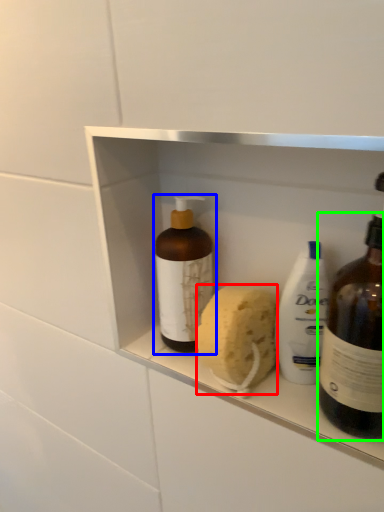
Question: Based on their relative distances, which object is farther from soap (highlighted by a red box)? Choose from bottle (highlighted by a blue box) and bottle (highlighted by a green box).

Choices:
 (A) bottle
 (B) bottle

Answer: (B)